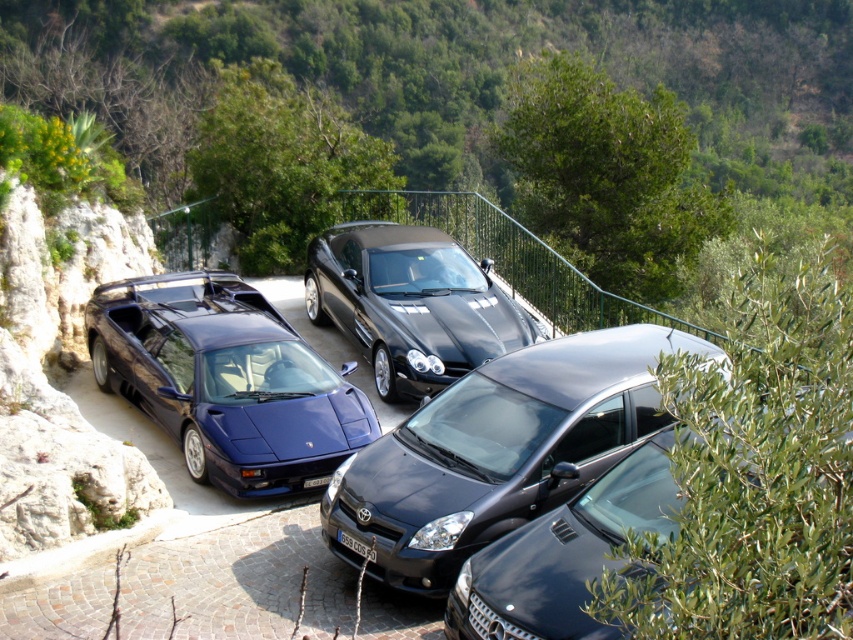
Between satin black hatchback at center and metallic blue sports car at left, which one has less height?

With less height is satin black hatchback at center.

Does satin black hatchback at center appear over metallic blue sports car at left?

Incorrect, satin black hatchback at center is not positioned above metallic blue sports car at left.

Find the location of a particular element. Image resolution: width=853 pixels, height=640 pixels. satin black hatchback at center is located at coordinates (495, 452).

Which is behind, point (424, 314) or point (601, 566)?

Point (424, 314)

Is glossy black sedan at center below glossy black car at center?

Actually, glossy black sedan at center is above glossy black car at center.

What do you see at coordinates (410, 305) in the screenshot? The image size is (853, 640). I see `glossy black sedan at center` at bounding box center [410, 305].

In order to click on glossy black sedan at center in this screenshot , I will do `click(410, 305)`.

Which is more to the right, satin black hatchback at center or glossy black sedan at center?

Positioned to the right is satin black hatchback at center.

The image size is (853, 640). In order to click on satin black hatchback at center in this screenshot , I will do `click(495, 452)`.

The width and height of the screenshot is (853, 640). Describe the element at coordinates (495, 452) in the screenshot. I see `satin black hatchback at center` at that location.

Identify the location of satin black hatchback at center. (495, 452).